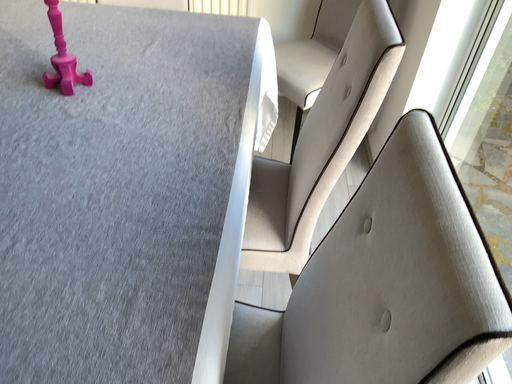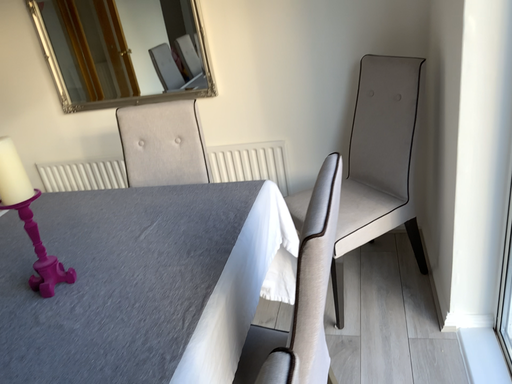
Question: Which way did the camera rotate in the video?

Choices:
 (A) rotated right
 (B) rotated left

Answer: (B)